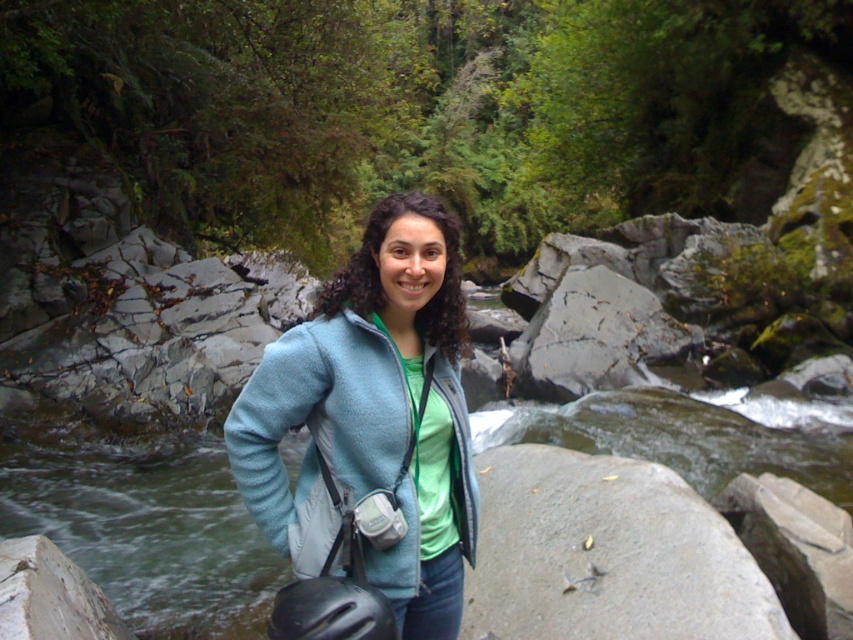
You are a photographer carrying a tripod that is 3 feet wide. You need to set it up between the light blue fleece jacket at center and the gray smooth rock at lower left. Is there enough space for the tripod?

The distance between the light blue fleece jacket at center and the gray smooth rock at lower left is 3.61 feet. Since the tripod is 3 feet wide, there is enough space to set it up between them.